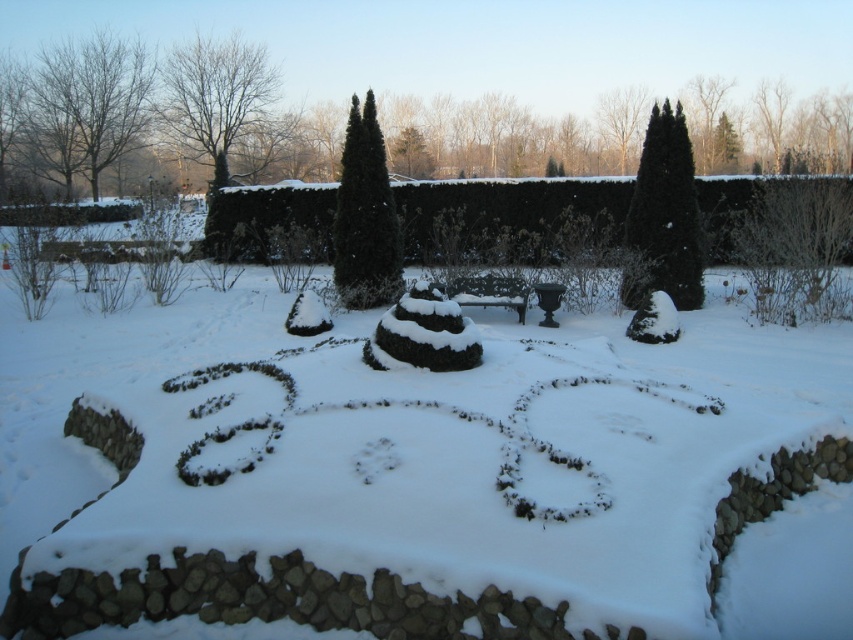
Question: Is the position of brown leafless tree at upper left less distant than that of black textured hedge at upper right?

Choices:
 (A) yes
 (B) no

Answer: (B)

Question: Is green leafy hedge at center below brown leafless tree at upper left?

Choices:
 (A) no
 (B) yes

Answer: (B)

Question: Among these objects, which one is nearest to the camera?

Choices:
 (A) green leafy hedge at center
 (B) green textured hedge at center
 (C) brown leafless tree at upper left
 (D) bare branches at upper left

Answer: (A)

Question: Among these objects, which one is farthest from the camera?

Choices:
 (A) bare branches at upper left
 (B) green textured hedge at center
 (C) green leafy hedge at center
 (D) brown leafless tree at upper left

Answer: (A)

Question: Among these objects, which one is farthest from the camera?

Choices:
 (A) green textured hedge at center
 (B) bare branches at upper left
 (C) black textured hedge at upper right

Answer: (B)

Question: Can you confirm if black textured hedge at upper right is wider than green textured hedge at center?

Choices:
 (A) no
 (B) yes

Answer: (A)